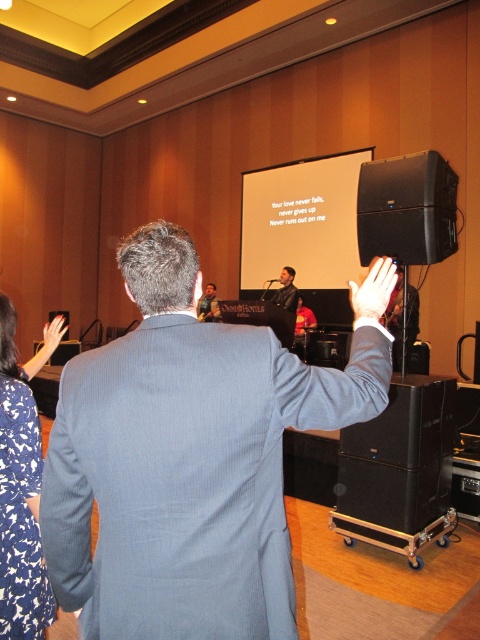
Question: Based on their relative distances, which object is nearer to the blue pinstripe suit at center?

Choices:
 (A) blue floral dress at lower left
 (B) white matte projection screen at center
 (C) white matte hand at upper center
 (D) black matte speaker at lower right

Answer: (A)

Question: Observing the image, what is the correct spatial positioning of white matte projection screen at center in reference to black matte speaker at lower right?

Choices:
 (A) below
 (B) above

Answer: (B)

Question: Which object is farther from the camera taking this photo?

Choices:
 (A) white matte projection screen at center
 (B) blue pinstripe suit at center
 (C) black matte speaker at lower right
 (D) matte black hand at upper left

Answer: (A)

Question: Can you confirm if white matte hand at upper center is bigger than black plastic speaker at center?

Choices:
 (A) no
 (B) yes

Answer: (A)

Question: Observing the image, what is the correct spatial positioning of blue pinstripe suit at center in reference to shiny black suit at center?

Choices:
 (A) below
 (B) above

Answer: (A)

Question: Which of the following is the closest to the observer?

Choices:
 (A) (283, 305)
 (B) (478, 323)
 (C) (104, 403)

Answer: (C)